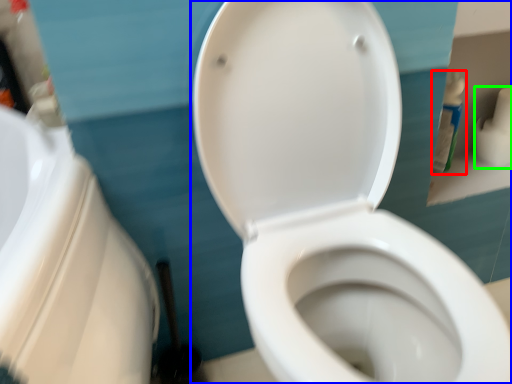
Question: Considering the real-world distances, which object is closest to cleaning product (highlighted by a red box)? toilet (highlighted by a blue box) or toilet paper (highlighted by a green box).

Choices:
 (A) toilet
 (B) toilet paper

Answer: (B)